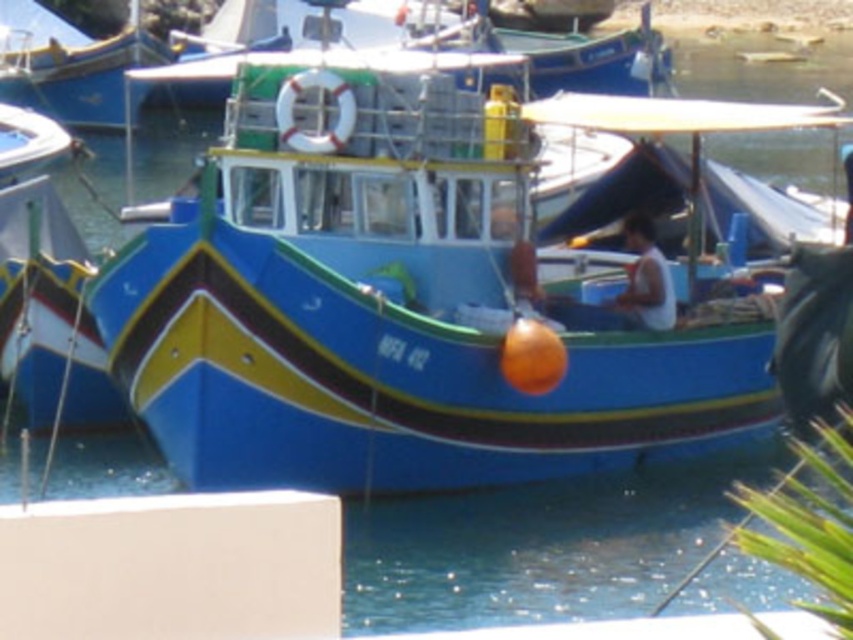
Between blue glossy boat at upper left and white fabric shirt at right, which one has more height?

With more height is blue glossy boat at upper left.

Is blue glossy boat at upper left to the right of white fabric shirt at right from the viewer's perspective?

No, blue glossy boat at upper left is not to the right of white fabric shirt at right.

Measure the distance between blue glossy boat at upper left and camera.

blue glossy boat at upper left is 66.34 meters from camera.

Find the location of a particular element. The width and height of the screenshot is (853, 640). blue glossy boat at upper left is located at coordinates (71, 68).

Which is more to the right, blue glossy boat at center or blue glossy boat at upper left?

From the viewer's perspective, blue glossy boat at center appears more on the right side.

Is point (399, 474) positioned after point (74, 35)?

No, it is not.

What do you see at coordinates (387, 307) in the screenshot? I see `blue glossy boat at center` at bounding box center [387, 307].

The width and height of the screenshot is (853, 640). What are the coordinates of `blue glossy boat at center` in the screenshot? It's located at (387, 307).

Is blue glossy boat at center above white fabric shirt at right?

Correct, blue glossy boat at center is located above white fabric shirt at right.

Is point (363, 234) in front of point (625, 240)?

Yes, point (363, 234) is in front of point (625, 240).

Between point (578, 358) and point (635, 216), which one is positioned behind?

The point (635, 216) is more distant.

Where is `blue glossy boat at center`? This screenshot has width=853, height=640. blue glossy boat at center is located at coordinates (387, 307).